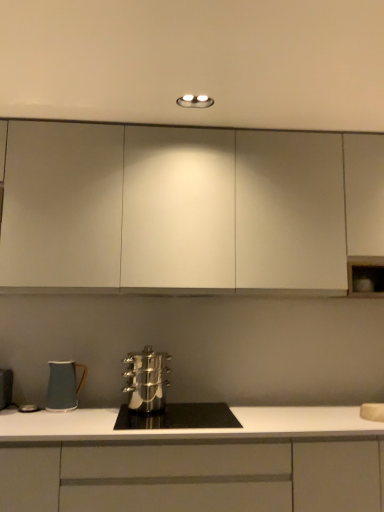
What do you see at coordinates (187, 208) in the screenshot?
I see `white matte cabinet at upper center, the second cabinetry in the bottom-to-top sequence` at bounding box center [187, 208].

Find the location of a particular element. stainless steel steamer at center, the 1th kitchen appliance in the right-to-left sequence is located at coordinates (146, 380).

Identify the location of matte ceramic mug at lower left, the second kitchen appliance positioned from the right. (64, 386).

Measure the distance between point [152,417] and camera.

6.82 feet.

What are the coordinates of `white matte cabinet at upper center, the second cabinetry in the bottom-to-top sequence` in the screenshot? It's located at (187, 208).

Does white matte sink at lower right turn towards stainless steel cookware at center?

No, white matte sink at lower right is not oriented towards stainless steel cookware at center.

Between white matte sink at lower right and stainless steel cookware at center, which one has more height?

With more height is white matte sink at lower right.

Is white matte sink at lower right not within stainless steel cookware at center?

Yes, white matte sink at lower right is located beyond the bounds of stainless steel cookware at center.

The width and height of the screenshot is (384, 512). I want to click on home appliance below the white matte cabinet at upper center, the first cabinetry in the top-to-bottom sequence (from a real-world perspective), so click(x=178, y=417).

Between white matte cabinet at upper center, the first cabinetry in the top-to-bottom sequence, and stainless steel cookware at center, which one has less height?

stainless steel cookware at center.

From a real-world perspective, who is located lower, white matte cabinet at upper center, the first cabinetry in the top-to-bottom sequence, or stainless steel cookware at center?

stainless steel cookware at center.

Are white matte cabinet at upper center, the first cabinetry in the top-to-bottom sequence, and stainless steel cookware at center far apart?

No.

How different are the orientations of matte ceramic mug at lower left, marked as the first kitchen appliance in a left-to-right arrangement, and stainless steel cookware at center in degrees?

The facing directions of matte ceramic mug at lower left, marked as the first kitchen appliance in a left-to-right arrangement, and stainless steel cookware at center are 0.000825 degrees apart.

Considering the relative sizes of matte ceramic mug at lower left, the second kitchen appliance positioned from the right, and stainless steel cookware at center in the image provided, is matte ceramic mug at lower left, the second kitchen appliance positioned from the right, shorter than stainless steel cookware at center?

In fact, matte ceramic mug at lower left, the second kitchen appliance positioned from the right, may be taller than stainless steel cookware at center.

Is point (63, 367) in front of point (169, 420)?

That is False.

Considering the sizes of objects matte ceramic mug at lower left, the second kitchen appliance positioned from the right, and stainless steel cookware at center in the image provided, who is thinner, matte ceramic mug at lower left, the second kitchen appliance positioned from the right, or stainless steel cookware at center?

With smaller width is matte ceramic mug at lower left, the second kitchen appliance positioned from the right.

Looking at this image, is stainless steel cookware at center to the left or to the right of white matte sink at lower right in the image?

From the image, it's evident that stainless steel cookware at center is to the left of white matte sink at lower right.

From the picture: Is stainless steel cookware at center next to white matte sink at lower right?

No, stainless steel cookware at center is not next to white matte sink at lower right.

Considering the relative sizes of stainless steel cookware at center and white matte sink at lower right in the image provided, is stainless steel cookware at center bigger than white matte sink at lower right?

Correct, stainless steel cookware at center is larger in size than white matte sink at lower right.

From the image's perspective, is white matte cabinet at upper center, the first cabinetry in the top-to-bottom sequence, above or below white matte sink at lower right?

Based on their image positions, white matte cabinet at upper center, the first cabinetry in the top-to-bottom sequence, is located above white matte sink at lower right.

Does white matte cabinet at upper center, the second cabinetry in the bottom-to-top sequence, appear on the left side of white matte sink at lower right?

Correct, you'll find white matte cabinet at upper center, the second cabinetry in the bottom-to-top sequence, to the left of white matte sink at lower right.

How different are the orientations of white matte cabinet at upper center, the first cabinetry in the top-to-bottom sequence, and white matte sink at lower right in degrees?

white matte cabinet at upper center, the first cabinetry in the top-to-bottom sequence, and white matte sink at lower right are facing 23.7 degrees away from each other.

Between white matte cabinet at upper center, the second cabinetry in the bottom-to-top sequence, and white matte sink at lower right, which one has less height?

white matte sink at lower right is shorter.

Between stainless steel steamer at center, the 1th kitchen appliance in the right-to-left sequence, and matte ceramic mug at lower left, marked as the first kitchen appliance in a left-to-right arrangement, which one appears on the left side from the viewer's perspective?

matte ceramic mug at lower left, marked as the first kitchen appliance in a left-to-right arrangement, is more to the left.

Looking at the image, does stainless steel steamer at center, the 2th kitchen appliance viewed from the left, seem bigger or smaller compared to matte ceramic mug at lower left, the second kitchen appliance positioned from the right?

Clearly, stainless steel steamer at center, the 2th kitchen appliance viewed from the left, is larger in size than matte ceramic mug at lower left, the second kitchen appliance positioned from the right.

From a real-world perspective, is stainless steel steamer at center, the 2th kitchen appliance viewed from the left, under matte ceramic mug at lower left, marked as the first kitchen appliance in a left-to-right arrangement?

No, from a real-world perspective, stainless steel steamer at center, the 2th kitchen appliance viewed from the left, is not under matte ceramic mug at lower left, marked as the first kitchen appliance in a left-to-right arrangement.

Between white matte sink at lower right and matte ceramic mug at lower left, marked as the first kitchen appliance in a left-to-right arrangement, which one appears on the left side from the viewer's perspective?

matte ceramic mug at lower left, marked as the first kitchen appliance in a left-to-right arrangement.

Could you tell me if white matte sink at lower right is turned towards matte ceramic mug at lower left, the second kitchen appliance positioned from the right?

No, white matte sink at lower right is not oriented towards matte ceramic mug at lower left, the second kitchen appliance positioned from the right.

Considering the sizes of objects white matte sink at lower right and matte ceramic mug at lower left, marked as the first kitchen appliance in a left-to-right arrangement, in the image provided, who is smaller, white matte sink at lower right or matte ceramic mug at lower left, marked as the first kitchen appliance in a left-to-right arrangement,?

white matte sink at lower right.

Based on the photo, from the image's perspective, who appears lower, white matte sink at lower right or matte ceramic mug at lower left, marked as the first kitchen appliance in a left-to-right arrangement?

white matte sink at lower right, from the image's perspective.

Locate an element on the screen. home appliance below the white matte sink at lower right (from a real-world perspective) is located at coordinates (178, 417).

I want to click on home appliance in front of the white matte cabinet at upper center, the first cabinetry in the top-to-bottom sequence, so click(x=178, y=417).

Consider the image. From the image, which object appears to be nearer to white matte cabinet at upper center, the second cabinetry in the bottom-to-top sequence, white matte cabinet at center, which is the first cabinetry in bottom-to-top order, or stainless steel steamer at center, the 1th kitchen appliance in the right-to-left sequence?

Based on the image, stainless steel steamer at center, the 1th kitchen appliance in the right-to-left sequence, appears to be nearer to white matte cabinet at upper center, the second cabinetry in the bottom-to-top sequence.

Looking at the image, which one is located further to white matte cabinet at center, the second cabinetry viewed from the top, stainless steel steamer at center, the 2th kitchen appliance viewed from the left, or matte ceramic mug at lower left, marked as the first kitchen appliance in a left-to-right arrangement?

matte ceramic mug at lower left, marked as the first kitchen appliance in a left-to-right arrangement.

Looking at the image, which one is located further to matte ceramic mug at lower left, marked as the first kitchen appliance in a left-to-right arrangement, stainless steel steamer at center, the 1th kitchen appliance in the right-to-left sequence, or white matte cabinet at center, which is the first cabinetry in bottom-to-top order?

The object further to matte ceramic mug at lower left, marked as the first kitchen appliance in a left-to-right arrangement, is white matte cabinet at center, which is the first cabinetry in bottom-to-top order.

Estimate the real-world distances between objects in this image. Which object is further from stainless steel cookware at center, white matte sink at lower right or stainless steel steamer at center, the 1th kitchen appliance in the right-to-left sequence?

white matte sink at lower right is positioned further to the anchor stainless steel cookware at center.

When comparing their distances from white matte cabinet at center, the second cabinetry viewed from the top, does white matte sink at lower right or stainless steel cookware at center seem further?

Among the two, white matte sink at lower right is located further to white matte cabinet at center, the second cabinetry viewed from the top.

Estimate the real-world distances between objects in this image. Which object is further from white matte sink at lower right, white matte cabinet at center, which is the first cabinetry in bottom-to-top order, or white matte cabinet at upper center, the second cabinetry in the bottom-to-top sequence?

white matte cabinet at upper center, the second cabinetry in the bottom-to-top sequence, is further to white matte sink at lower right.

From the image, which object appears to be farther from stainless steel steamer at center, the 2th kitchen appliance viewed from the left, stainless steel cookware at center or white matte cabinet at center, which is the first cabinetry in bottom-to-top order?

white matte cabinet at center, which is the first cabinetry in bottom-to-top order, lies further to stainless steel steamer at center, the 2th kitchen appliance viewed from the left, than the other object.

From the image, which object appears to be farther from stainless steel cookware at center, matte ceramic mug at lower left, the second kitchen appliance positioned from the right, or stainless steel steamer at center, the 1th kitchen appliance in the right-to-left sequence?

matte ceramic mug at lower left, the second kitchen appliance positioned from the right.

This screenshot has height=512, width=384. Identify the location of kitchen appliance between white matte cabinet at upper center, the second cabinetry in the bottom-to-top sequence, and matte ceramic mug at lower left, the second kitchen appliance positioned from the right, in the vertical direction. (146, 380).

Identify the location of home appliance that lies between stainless steel steamer at center, the 1th kitchen appliance in the right-to-left sequence, and white matte cabinet at center, which is the first cabinetry in bottom-to-top order, from top to bottom. The height and width of the screenshot is (512, 384). (178, 417).

You are a GUI agent. You are given a task and a screenshot of the screen. Output one action in this format:
    pyautogui.click(x=<x>, y=<y>)
    Task: Click on the sink between white matte cabinet at upper center, the second cabinetry in the bottom-to-top sequence, and white matte cabinet at center, the second cabinetry viewed from the top, from top to bottom
    Image resolution: width=384 pixels, height=512 pixels.
    Given the screenshot: What is the action you would take?
    pyautogui.click(x=372, y=412)

Find the location of `home appliance between matte ceramic mug at lower left, the second kitchen appliance positioned from the right, and white matte cabinet at center, the second cabinetry viewed from the top`. home appliance between matte ceramic mug at lower left, the second kitchen appliance positioned from the right, and white matte cabinet at center, the second cabinetry viewed from the top is located at coordinates (178, 417).